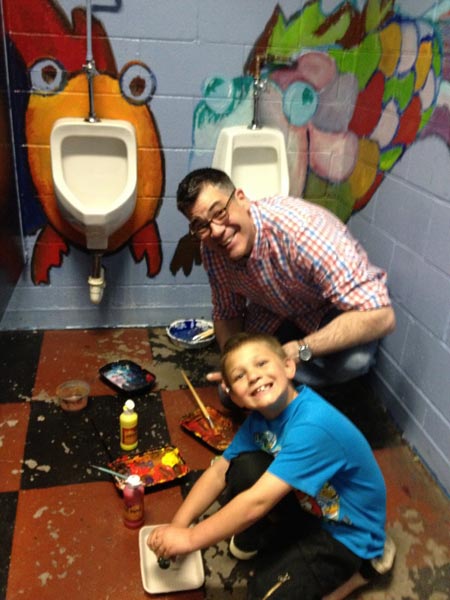
Identify the location of urinal pipe. The width and height of the screenshot is (450, 600). (89, 103), (257, 114).